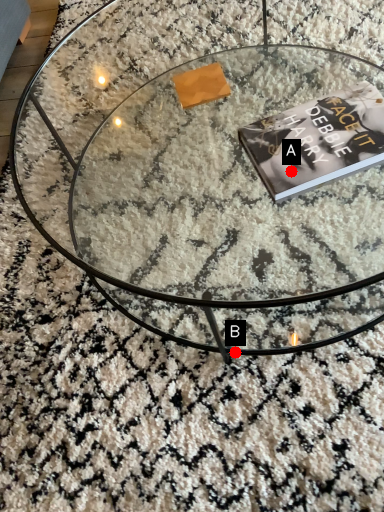
Question: Two points are circled on the image, labeled by A and B beside each circle. Which point is farther to the camera?

Choices:
 (A) A is further
 (B) B is further

Answer: (B)